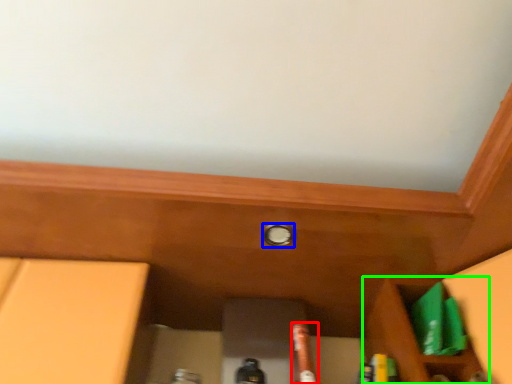
Question: Which object is positioned closest to beer bottle (highlighted by a red box)? Select from knob (highlighted by a blue box) and cabinetry (highlighted by a green box).

Choices:
 (A) knob
 (B) cabinetry

Answer: (B)